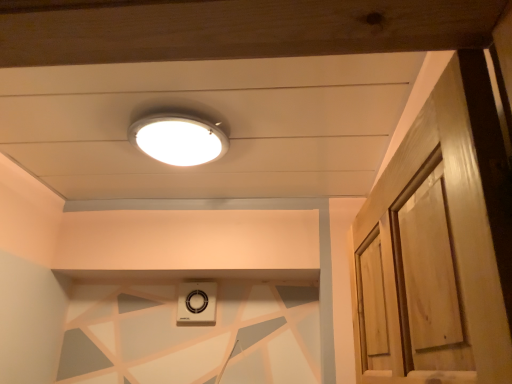
Question: Is white plastic vent at lower center in front of or behind white glossy lamp at upper center in the image?

Choices:
 (A) front
 (B) behind

Answer: (B)

Question: Considering the positions of white plastic vent at lower center and white glossy lamp at upper center in the image, is white plastic vent at lower center taller or shorter than white glossy lamp at upper center?

Choices:
 (A) tall
 (B) short

Answer: (A)

Question: Looking at the image, does white plastic vent at lower center seem bigger or smaller compared to white glossy lamp at upper center?

Choices:
 (A) small
 (B) big

Answer: (A)

Question: Considering the relative positions of white glossy lamp at upper center and white plastic vent at lower center in the image provided, is white glossy lamp at upper center to the left or to the right of white plastic vent at lower center?

Choices:
 (A) right
 (B) left

Answer: (A)

Question: Is point (154, 144) closer or farther from the camera than point (188, 301)?

Choices:
 (A) farther
 (B) closer

Answer: (B)

Question: Relative to white plastic vent at lower center, is white glossy lamp at upper center in front or behind?

Choices:
 (A) front
 (B) behind

Answer: (A)

Question: Is white glossy lamp at upper center taller or shorter than white plastic vent at lower center?

Choices:
 (A) short
 (B) tall

Answer: (A)